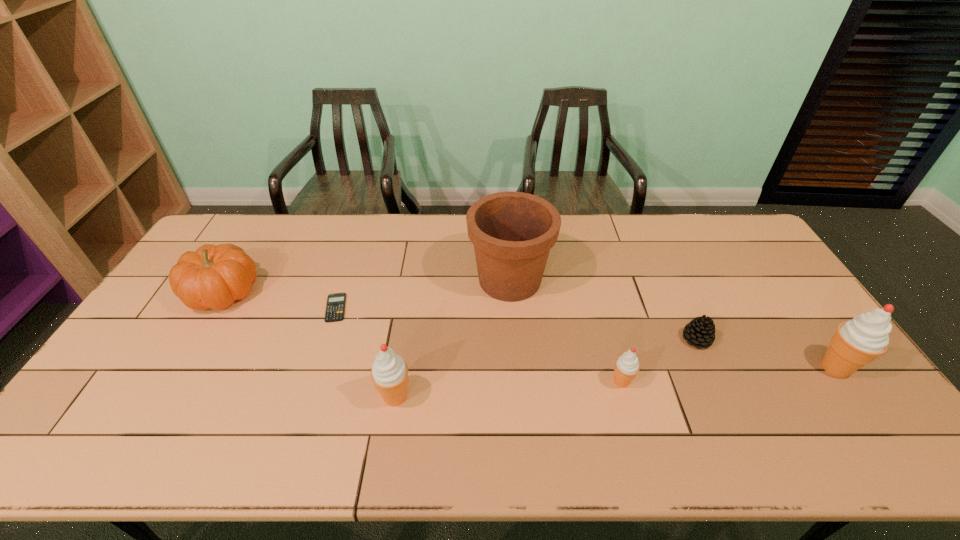
Where is `free region located on the front of the pumpkin`? free region located on the front of the pumpkin is located at coordinates (163, 393).

At what (x,y) coordinates should I click in order to perform the action: click on object that is at the far edge. Please return your answer as a coordinate pair (x, y). Looking at the image, I should click on (512, 232).

Image resolution: width=960 pixels, height=540 pixels. I want to click on object that is at the left edge, so click(214, 276).

At what (x,y) coordinates should I click in order to perform the action: click on object that is at the right edge. Please return your answer as a coordinate pair (x, y). The height and width of the screenshot is (540, 960). Looking at the image, I should click on (857, 342).

This screenshot has height=540, width=960. In order to click on vacant region at the far edge in this screenshot , I will do `click(359, 226)`.

You are a GUI agent. You are given a task and a screenshot of the screen. Output one action in this format:
    pyautogui.click(x=<x>, y=<y>)
    Task: Click on the vacant space at the near edge of the desktop
    The image size is (960, 540).
    Given the screenshot: What is the action you would take?
    pyautogui.click(x=705, y=388)

The height and width of the screenshot is (540, 960). Identify the location of free space at the left edge of the desktop. (200, 314).

In the image, there is a desktop. At what (x,y) coordinates should I click in order to perform the action: click on vacant area at the right edge. Please return your answer as a coordinate pair (x, y). The image size is (960, 540). Looking at the image, I should click on (810, 362).

The image size is (960, 540). Find the location of `vacant area at the far right corner`. vacant area at the far right corner is located at coordinates (731, 215).

Find the location of a particular element. Image resolution: width=960 pixels, height=540 pixels. vacant region at the near right corner of the desktop is located at coordinates (874, 409).